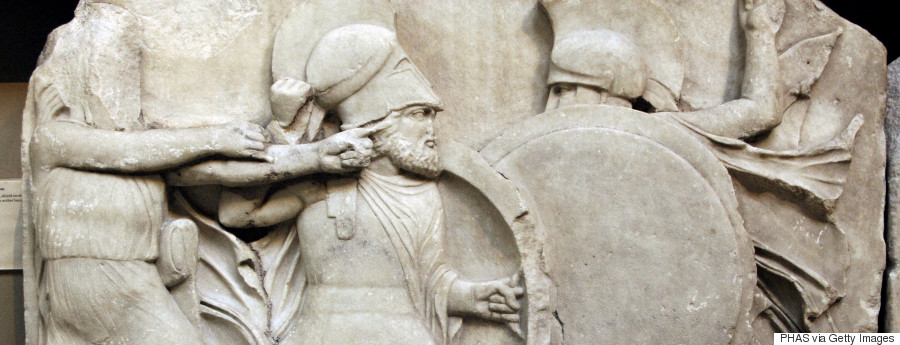
In order to click on statue in this screenshot , I will do `click(364, 263)`.